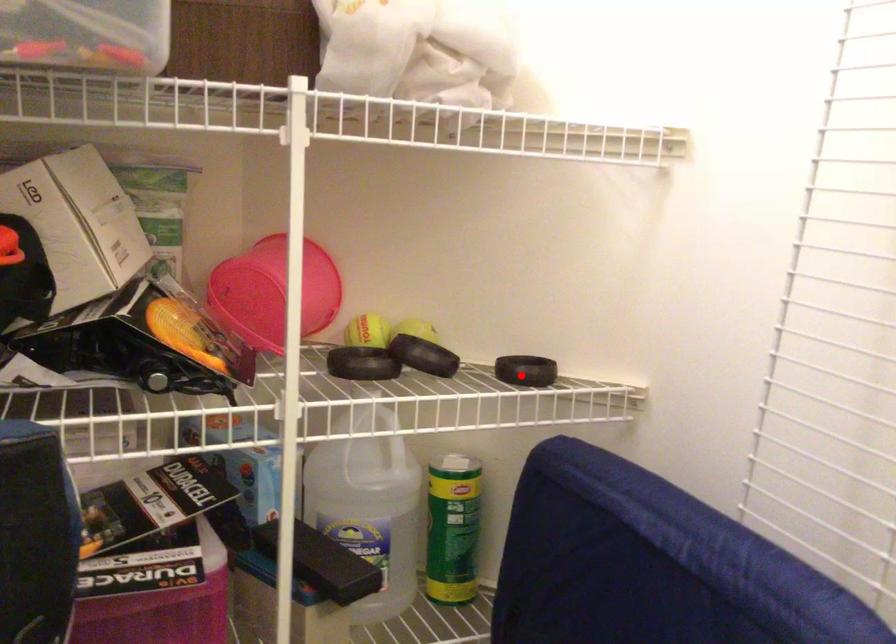
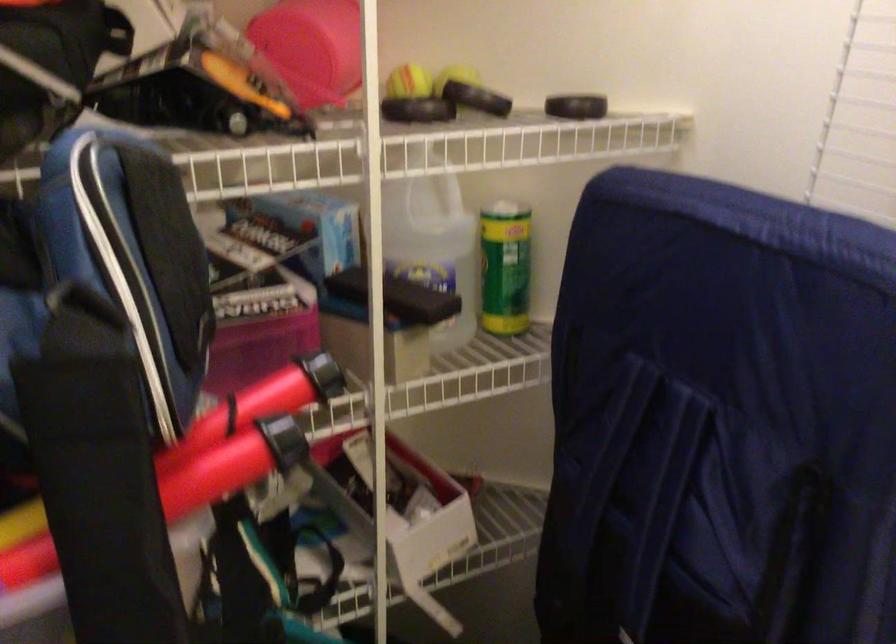
Find the pixel in the second image that matches the highlighted location in the first image.

(576, 106)